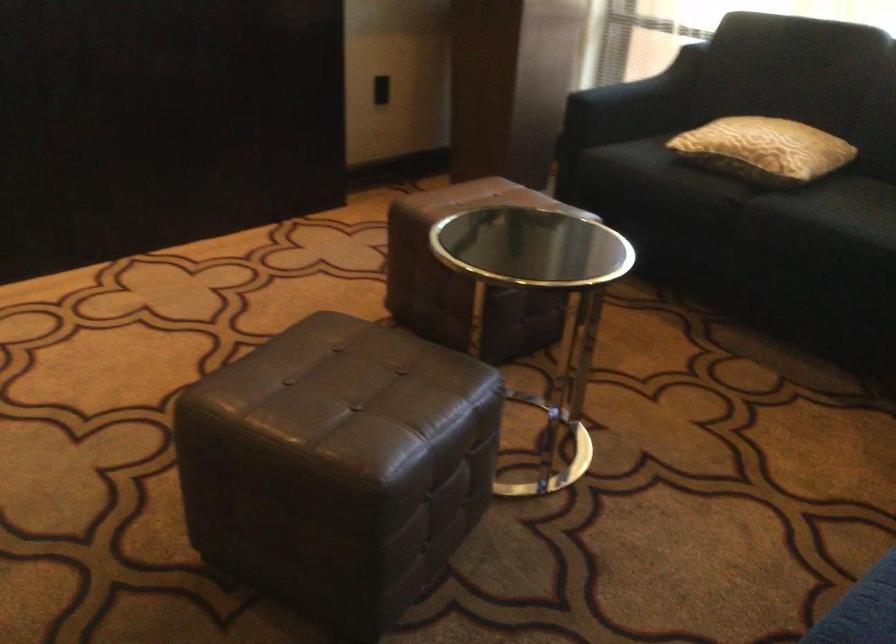
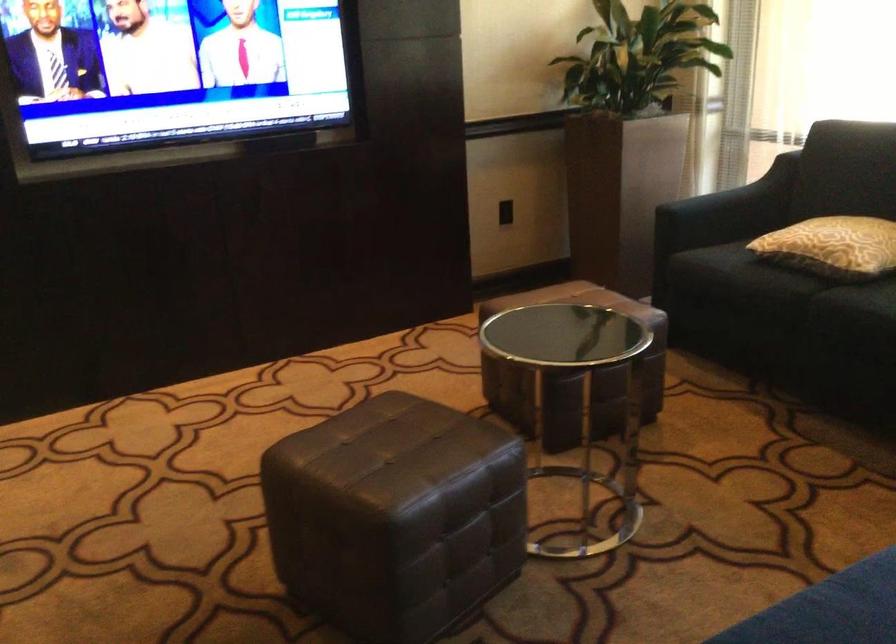
Locate, in the second image, the point that corresponds to pixel 651 91 in the first image.

(742, 196)